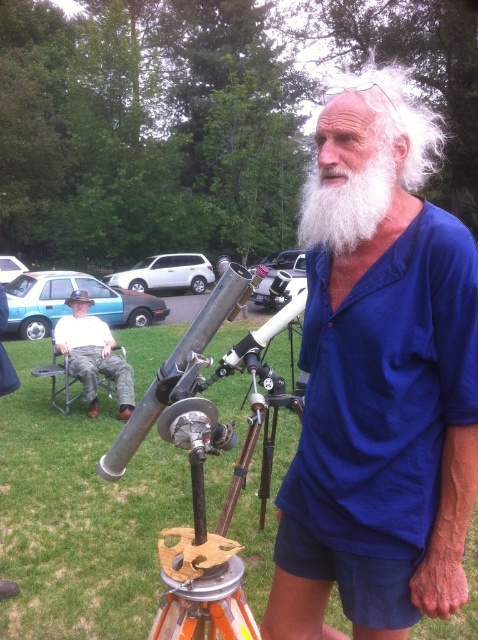
Question: Does white curly hair at upper center have a greater width compared to white cotton shirt at lower left?

Choices:
 (A) no
 (B) yes

Answer: (B)

Question: Does white curly hair at upper center appear over white cotton shirt at lower left?

Choices:
 (A) no
 (B) yes

Answer: (B)

Question: From the image, what is the correct spatial relationship of polished silver telescope at center in relation to white cotton shirt at lower left?

Choices:
 (A) left
 (B) right

Answer: (B)

Question: Which object is positioned farthest from the white curly hair at upper center?

Choices:
 (A) whitewoollybeard at right
 (B) polished silver telescope at center
 (C) white cotton shirt at lower left
 (D) white fluffy beard at center

Answer: (A)

Question: Which point appears farthest from the camera in this image?

Choices:
 (A) (228, 561)
 (B) (133, 394)
 (C) (456, 256)
 (D) (368, 189)

Answer: (B)

Question: Which object is positioned closest to the white fluffy beard at center?

Choices:
 (A) polished silver telescope at center
 (B) white cotton shirt at lower left
 (C) whitewoollybeard at right

Answer: (A)